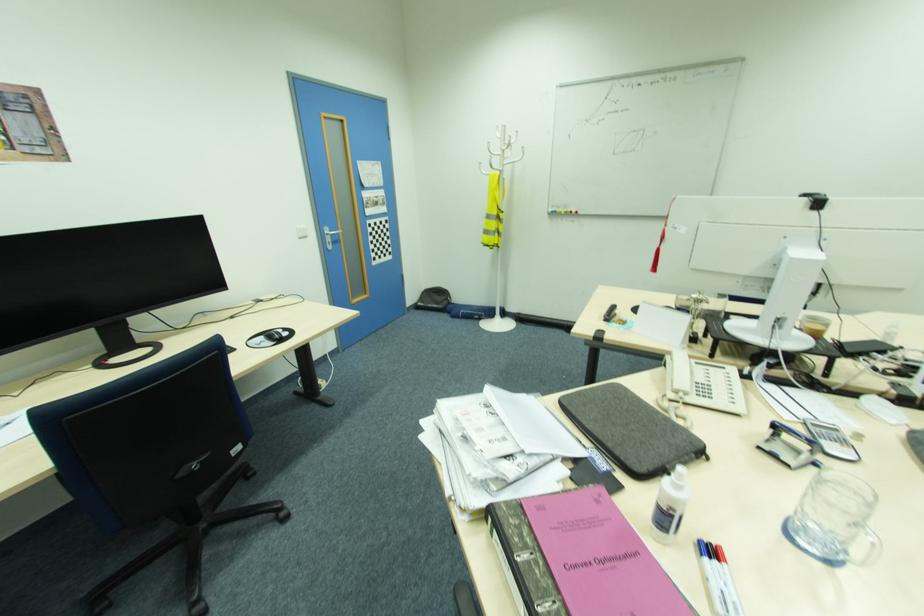
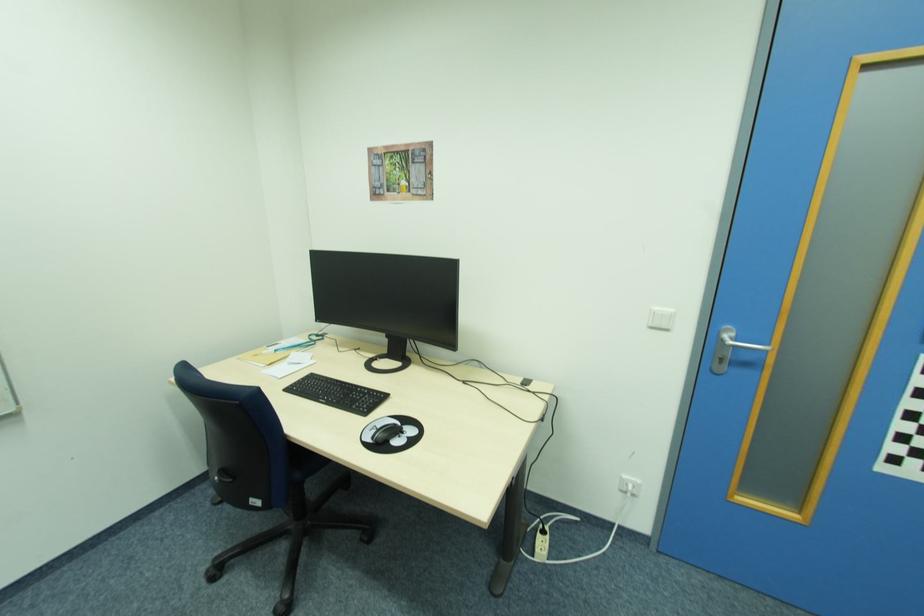
Locate, in the second image, the point that corresponds to (342,233) in the first image.

(768, 350)